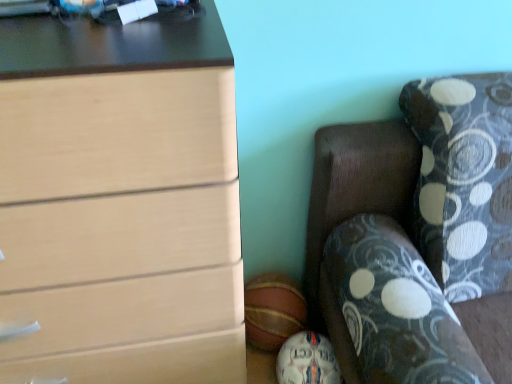
What is the approximate width of white leather soccer ball at lower center, the 2th sports equipment viewed from the top?

The width of white leather soccer ball at lower center, the 2th sports equipment viewed from the top, is 6.55 inches.

This screenshot has width=512, height=384. What do you see at coordinates (307, 360) in the screenshot?
I see `white leather soccer ball at lower center, the 1th sports equipment when ordered from bottom to top` at bounding box center [307, 360].

In order to face matte wood chest of drawers at left, should I rotate leftwards or rightwards?

Rotate left and turn 23.909 degrees.

At what (x,y) coordinates should I click in order to perform the action: click on matte wood chest of drawers at left. Please return your answer as a coordinate pair (x, y). The image size is (512, 384). Looking at the image, I should click on [x=120, y=202].

At what (x,y) coordinates should I click in order to perform the action: click on rubber basketball at lower center, the 1th sports equipment positioned from the top. Please return your answer as a coordinate pair (x, y). Looking at the image, I should click on (273, 310).

Find the location of a particular element. The image size is (512, 384). dark wood couch at lower right is located at coordinates (413, 230).

Considering the sizes of objects dark wood couch at lower right and white leather soccer ball at lower center, the 1th sports equipment when ordered from bottom to top, in the image provided, who is bigger, dark wood couch at lower right or white leather soccer ball at lower center, the 1th sports equipment when ordered from bottom to top,?

Bigger between the two is dark wood couch at lower right.

Is dark wood couch at lower right facing towards white leather soccer ball at lower center, the 2th sports equipment viewed from the top?

No, dark wood couch at lower right is not facing towards white leather soccer ball at lower center, the 2th sports equipment viewed from the top.

Is dark wood couch at lower right placed right next to white leather soccer ball at lower center, the 2th sports equipment viewed from the top?

No, dark wood couch at lower right is not next to white leather soccer ball at lower center, the 2th sports equipment viewed from the top.

Which sports equipment is the 1st one when counting from the left side of the dark wood couch at lower right? Please provide its 2D coordinates.

[(307, 360)]

From a real-world perspective, between rubber basketball at lower center, the 1th sports equipment positioned from the top, and white leather soccer ball at lower center, the 1th sports equipment when ordered from bottom to top, who is vertically higher?

In real-world perspective, rubber basketball at lower center, the 1th sports equipment positioned from the top, is above.

Measure the distance from rubber basketball at lower center, which is the 2th sports equipment from bottom to top, to white leather soccer ball at lower center, the 1th sports equipment when ordered from bottom to top.

The distance of rubber basketball at lower center, which is the 2th sports equipment from bottom to top, from white leather soccer ball at lower center, the 1th sports equipment when ordered from bottom to top, is 5.18 inches.

Is rubber basketball at lower center, which is the 2th sports equipment from bottom to top, facing away from white leather soccer ball at lower center, the 1th sports equipment when ordered from bottom to top?

No, white leather soccer ball at lower center, the 1th sports equipment when ordered from bottom to top, is not at the back of rubber basketball at lower center, which is the 2th sports equipment from bottom to top.

Would you say dark wood couch at lower right is part of rubber basketball at lower center, the 1th sports equipment positioned from the top,'s contents?

No, dark wood couch at lower right is not surrounded by rubber basketball at lower center, the 1th sports equipment positioned from the top.

From the image's perspective, which is above, rubber basketball at lower center, which is the 2th sports equipment from bottom to top, or dark wood couch at lower right?

dark wood couch at lower right.

Is point (302, 307) closer or farther from the camera than point (407, 369)?

Point (302, 307) appears to be farther away from the viewer than point (407, 369).

Looking at this image, can you tell me how much rubber basketball at lower center, the 1th sports equipment positioned from the top, and dark wood couch at lower right differ in facing direction?

The facing directions of rubber basketball at lower center, the 1th sports equipment positioned from the top, and dark wood couch at lower right are 1.45 degrees apart.

Who is shorter, dark wood couch at lower right or rubber basketball at lower center, which is the 2th sports equipment from bottom to top?

rubber basketball at lower center, which is the 2th sports equipment from bottom to top, is shorter.

From a real-world perspective, count 1st sports equipments downward from the dark wood couch at lower right and point to it. Please provide its 2D coordinates.

[(273, 310)]

From a real-world perspective, is dark wood couch at lower right positioned above or below rubber basketball at lower center, the 1th sports equipment positioned from the top?

dark wood couch at lower right is situated higher than rubber basketball at lower center, the 1th sports equipment positioned from the top, in the real world.

Can you confirm if dark wood couch at lower right is wider than rubber basketball at lower center, which is the 2th sports equipment from bottom to top?

Yes, dark wood couch at lower right is wider than rubber basketball at lower center, which is the 2th sports equipment from bottom to top.

Does matte wood chest of drawers at left appear on the right side of dark wood couch at lower right?

In fact, matte wood chest of drawers at left is to the left of dark wood couch at lower right.

Is matte wood chest of drawers at left wider than dark wood couch at lower right?

No.

Is point (64, 248) positioned after point (358, 135)?

No, (64, 248) is in front of (358, 135).

Which of these two, matte wood chest of drawers at left or dark wood couch at lower right, stands shorter?

dark wood couch at lower right is shorter.

Would you say matte wood chest of drawers at left contains rubber basketball at lower center, which is the 2th sports equipment from bottom to top?

No, rubber basketball at lower center, which is the 2th sports equipment from bottom to top, is not inside matte wood chest of drawers at left.

Is matte wood chest of drawers at left in front of or behind rubber basketball at lower center, which is the 2th sports equipment from bottom to top, in the image?

Clearly, matte wood chest of drawers at left is in front of rubber basketball at lower center, which is the 2th sports equipment from bottom to top.

From the image's perspective, is matte wood chest of drawers at left located above or below rubber basketball at lower center, which is the 2th sports equipment from bottom to top?

matte wood chest of drawers at left is above rubber basketball at lower center, which is the 2th sports equipment from bottom to top.

Is white leather soccer ball at lower center, the 2th sports equipment viewed from the top, inside or outside of dark wood couch at lower right?

white leather soccer ball at lower center, the 2th sports equipment viewed from the top, is spatially positioned inside dark wood couch at lower right.

From the image's perspective, which is below, white leather soccer ball at lower center, the 2th sports equipment viewed from the top, or dark wood couch at lower right?

From the image's view, white leather soccer ball at lower center, the 2th sports equipment viewed from the top, is below.

Which is in front, white leather soccer ball at lower center, the 1th sports equipment when ordered from bottom to top, or dark wood couch at lower right?

Positioned in front is dark wood couch at lower right.

At what (x,y) coordinates should I click in order to perform the action: click on the 1st sports equipment behind the dark wood couch at lower right, starting your count from the anchor. Please return your answer as a coordinate pair (x, y). This screenshot has width=512, height=384. Looking at the image, I should click on (307, 360).

Where is `sports equipment that is the 2nd object directly below the dark wood couch at lower right (from a real-world perspective)`? sports equipment that is the 2nd object directly below the dark wood couch at lower right (from a real-world perspective) is located at coordinates (307, 360).

Locate an element on the screen. The height and width of the screenshot is (384, 512). sports equipment that is on the left side of white leather soccer ball at lower center, the 2th sports equipment viewed from the top is located at coordinates (273, 310).

When comparing their distances from dark wood couch at lower right, does white leather soccer ball at lower center, the 1th sports equipment when ordered from bottom to top, or rubber basketball at lower center, which is the 2th sports equipment from bottom to top, seem further?

rubber basketball at lower center, which is the 2th sports equipment from bottom to top, lies further to dark wood couch at lower right than the other object.

Based on their spatial positions, is white leather soccer ball at lower center, the 2th sports equipment viewed from the top, or dark wood couch at lower right further from rubber basketball at lower center, the 1th sports equipment positioned from the top?

Among the two, dark wood couch at lower right is located further to rubber basketball at lower center, the 1th sports equipment positioned from the top.

Considering their positions, is white leather soccer ball at lower center, the 1th sports equipment when ordered from bottom to top, positioned closer to dark wood couch at lower right than matte wood chest of drawers at left?

white leather soccer ball at lower center, the 1th sports equipment when ordered from bottom to top, lies closer to dark wood couch at lower right than the other object.

Based on their spatial positions, is rubber basketball at lower center, the 1th sports equipment positioned from the top, or white leather soccer ball at lower center, the 2th sports equipment viewed from the top, closer to dark wood couch at lower right?

Based on the image, white leather soccer ball at lower center, the 2th sports equipment viewed from the top, appears to be nearer to dark wood couch at lower right.

Based on their spatial positions, is rubber basketball at lower center, which is the 2th sports equipment from bottom to top, or dark wood couch at lower right closer to white leather soccer ball at lower center, the 1th sports equipment when ordered from bottom to top?

rubber basketball at lower center, which is the 2th sports equipment from bottom to top, is positioned closer to the anchor white leather soccer ball at lower center, the 1th sports equipment when ordered from bottom to top.

Considering their positions, is dark wood couch at lower right positioned closer to matte wood chest of drawers at left than rubber basketball at lower center, the 1th sports equipment positioned from the top?

The object closer to matte wood chest of drawers at left is dark wood couch at lower right.

Looking at this image, from the image, which object appears to be farther from white leather soccer ball at lower center, the 1th sports equipment when ordered from bottom to top, dark wood couch at lower right or rubber basketball at lower center, the 1th sports equipment positioned from the top?

Based on the image, dark wood couch at lower right appears to be further to white leather soccer ball at lower center, the 1th sports equipment when ordered from bottom to top.

Looking at this image, based on their spatial positions, is matte wood chest of drawers at left or white leather soccer ball at lower center, the 1th sports equipment when ordered from bottom to top, further from rubber basketball at lower center, which is the 2th sports equipment from bottom to top?

matte wood chest of drawers at left.

Where is `sports equipment between matte wood chest of drawers at left and rubber basketball at lower center, which is the 2th sports equipment from bottom to top, from front to back`? The height and width of the screenshot is (384, 512). sports equipment between matte wood chest of drawers at left and rubber basketball at lower center, which is the 2th sports equipment from bottom to top, from front to back is located at coordinates (307, 360).

The height and width of the screenshot is (384, 512). What are the coordinates of `sports equipment between dark wood couch at lower right and rubber basketball at lower center, the 1th sports equipment positioned from the top, from front to back` in the screenshot? It's located at (307, 360).